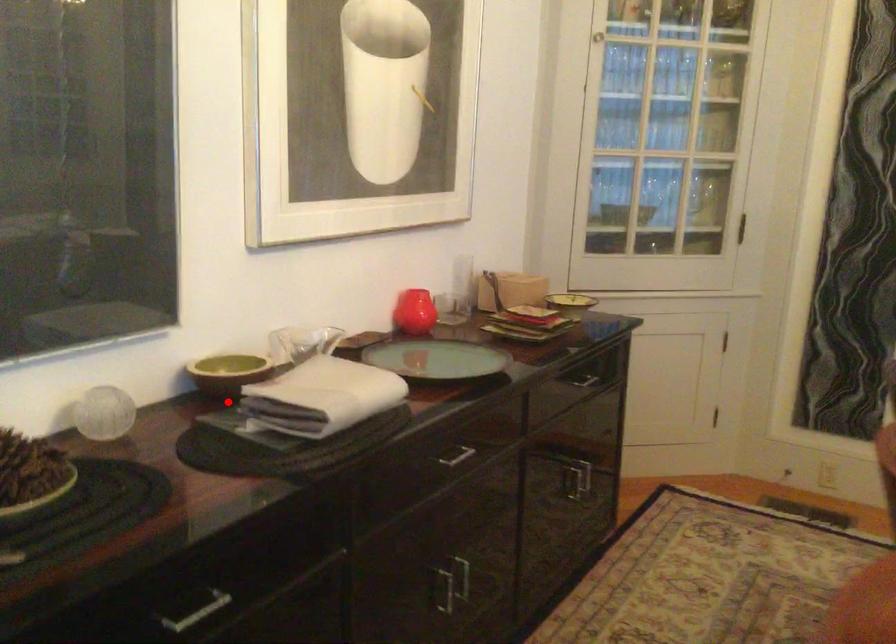
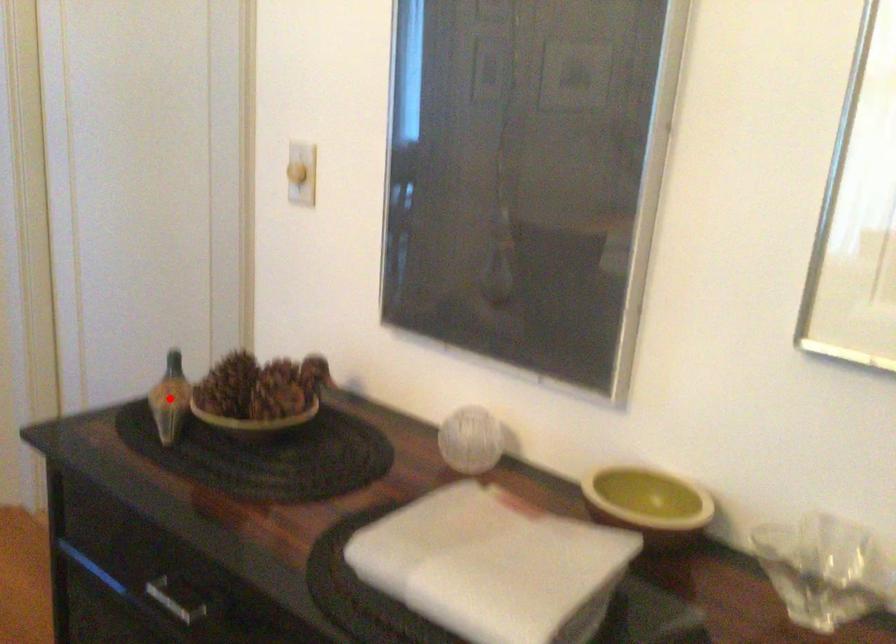
I am providing you with two images of the same scene from different viewpoints. A red point is marked on the first image and another point is marked on the second image. Do the highlighted points in image1 and image2 indicate the same real-world spot?

No